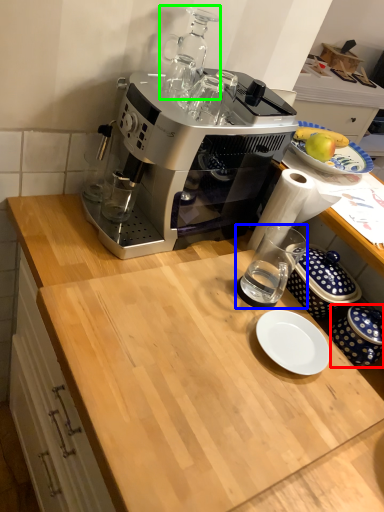
Question: Considering the real-world distances, which object is farthest from tableware (highlighted by a red box)? coffee cup (highlighted by a blue box) or appliance (highlighted by a green box)?

Choices:
 (A) coffee cup
 (B) appliance

Answer: (B)